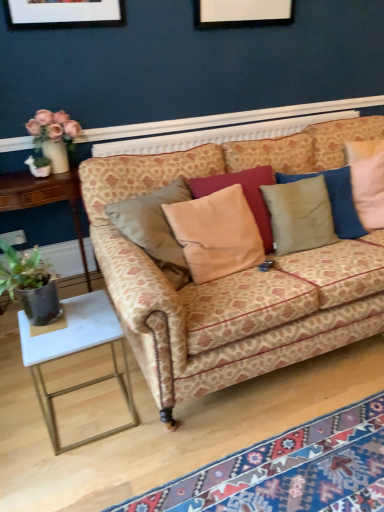
Locate an element on the screen. Image resolution: width=384 pixels, height=512 pixels. free spot above white marble side table at lower left, which is the first table in front-to-back order (from a real-world perspective) is located at coordinates (65, 324).